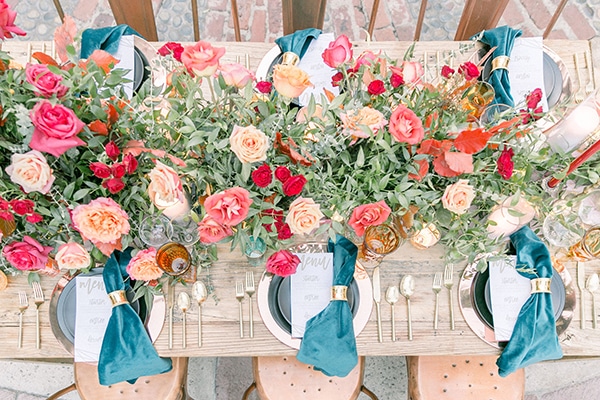
Identify the location of forks. The image size is (600, 400). (18, 326), (36, 327), (240, 316), (250, 313), (435, 302), (448, 303), (577, 79), (589, 73).